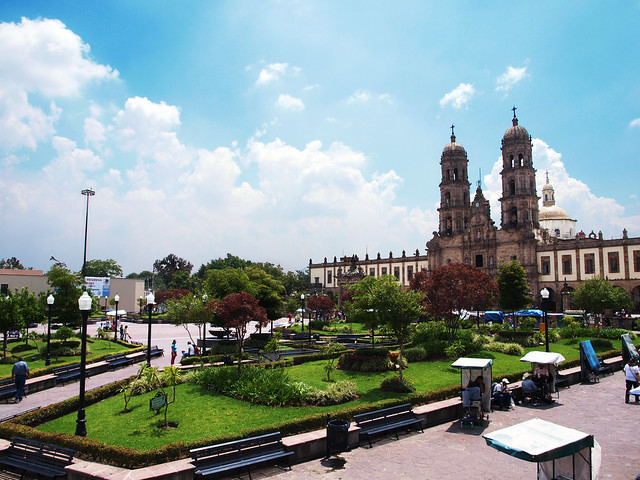
This screenshot has height=480, width=640. Identify the location of bench. (156, 350).